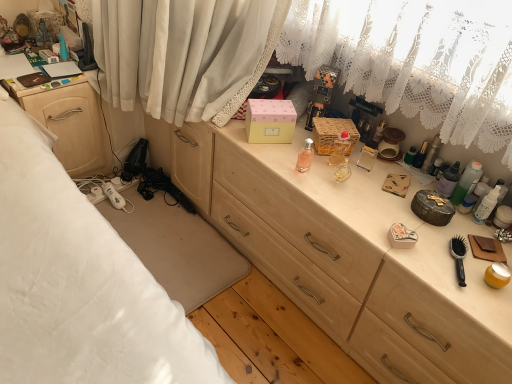
The height and width of the screenshot is (384, 512). What are the coordinates of `white glossy lotion at right, which ranks as the first toiletry in right-to-left order` in the screenshot? It's located at (486, 205).

Describe the element at coordinates (270, 121) in the screenshot. The image size is (512, 384). I see `pink matte box at center` at that location.

Measure the distance between point (332, 160) and camera.

The depth of point (332, 160) is 1.57 meters.

Measure the distance between light wood desk at center and camera.

The depth of light wood desk at center is 1.02 meters.

Find the location of `white glossy lotion at right, which is the fifth toiletry in left-to-right order`. white glossy lotion at right, which is the fifth toiletry in left-to-right order is located at coordinates (486, 205).

Considering the sizes of objects translucent plastic bottles at right, which ranks as the third toiletry in left-to-right order, and translucent glass perfume at center, acting as the second toiletry starting from the left, in the image provided, who is smaller, translucent plastic bottles at right, which ranks as the third toiletry in left-to-right order, or translucent glass perfume at center, acting as the second toiletry starting from the left,?

With smaller size is translucent plastic bottles at right, which ranks as the third toiletry in left-to-right order.

Would you say translucent glass perfume at center, acting as the second toiletry starting from the left, is part of translucent plastic bottles at right, the 3th toiletry in the right-to-left sequence,'s contents?

No, translucent glass perfume at center, acting as the second toiletry starting from the left, is not surrounded by translucent plastic bottles at right, the 3th toiletry in the right-to-left sequence.

Looking at this image, is translucent plastic bottles at right, the 3th toiletry in the right-to-left sequence, looking in the opposite direction of translucent glass perfume at center, acting as the 4th toiletry starting from the right?

No, translucent plastic bottles at right, the 3th toiletry in the right-to-left sequence, is not facing the opposite direction of translucent glass perfume at center, acting as the 4th toiletry starting from the right.

From a real-world perspective, between translucent plastic bottles at right, the 3th toiletry in the right-to-left sequence, and translucent glass perfume at center, acting as the 4th toiletry starting from the right, who is vertically lower?

translucent glass perfume at center, acting as the 4th toiletry starting from the right, from a real-world perspective.

Considering the points (390, 351) and (337, 121), which point is in front, point (390, 351) or point (337, 121)?

The point (390, 351) is closer to the camera.

Between light wood desk at center and woven brown picnic basket at center, which one has more height?

With more height is light wood desk at center.

Is light wood desk at center looking in the opposite direction of woven brown picnic basket at center?

No, light wood desk at center is not facing the opposite direction of woven brown picnic basket at center.

Is woven brown picnic basket at center located within light wood desk at center?

Definitely not — woven brown picnic basket at center is not inside light wood desk at center.

How many degrees apart are the facing directions of matte wood nightstand at left and woven brown picnic basket at center?

They differ by 34.4 degrees in their facing directions.

Is matte wood nightstand at left aimed at woven brown picnic basket at center?

No, matte wood nightstand at left is not oriented towards woven brown picnic basket at center.

Can you confirm if matte wood nightstand at left is wider than woven brown picnic basket at center?

Yes.

Is point (6, 89) positioned after point (328, 151)?

Yes, point (6, 89) is farther from viewer.

Based on the photo, from the image's perspective, which one is positioned lower, pink matte box at center or light wood desk at center?

light wood desk at center appears lower in the image.

Looking at this image, which is more to the right, pink matte box at center or light wood desk at center?

light wood desk at center.

From a real-world perspective, between pink matte box at center and light wood desk at center, who is vertically lower?

From a 3D spatial view, light wood desk at center is below.

Between translucent glass perfume at center, acting as the 4th toiletry starting from the right, and matte wood nightstand at left, which one has smaller size?

translucent glass perfume at center, acting as the 4th toiletry starting from the right.

Between translucent glass perfume at center, acting as the second toiletry starting from the left, and matte wood nightstand at left, which one is positioned in front?

translucent glass perfume at center, acting as the second toiletry starting from the left, is more forward.

Does point (349, 136) come farther from viewer compared to point (85, 146)?

No, it is not.

From the image's perspective, between translucent glass perfume at center, acting as the 4th toiletry starting from the right, and matte wood nightstand at left, which one is located above?

From the image's view, matte wood nightstand at left is above.

Is point (487, 210) closer or farther from the camera than point (223, 152)?

Clearly, point (487, 210) is closer to the camera than point (223, 152).

Which of these two, white glossy lotion at right, which is the fifth toiletry in left-to-right order, or light wood desk at center, is smaller?

With smaller size is white glossy lotion at right, which is the fifth toiletry in left-to-right order.

Does white glossy lotion at right, which is the fifth toiletry in left-to-right order, come in front of light wood desk at center?

That is False.

Can you tell me how much white glossy lotion at right, which is the fifth toiletry in left-to-right order, and light wood desk at center differ in facing direction?

white glossy lotion at right, which is the fifth toiletry in left-to-right order, and light wood desk at center are facing 1.85 degrees away from each other.

Does translucent glass perfume at center, acting as the second toiletry starting from the left, appear on the left side of translucent plastic bottles at right, positioned as the 4th toiletry in left-to-right order?

Yes.

At what (x,y) coordinates should I click in order to perform the action: click on the 3rd toiletry in front of the translucent glass perfume at center, acting as the second toiletry starting from the left. Please return your answer as a coordinate pair (x, y). This screenshot has width=512, height=384. Looking at the image, I should click on (466, 182).

Who is smaller, translucent glass perfume at center, acting as the second toiletry starting from the left, or translucent plastic bottles at right, positioned as the 4th toiletry in left-to-right order?

translucent glass perfume at center, acting as the second toiletry starting from the left, is smaller.

Does translucent glass perfume at center, acting as the 4th toiletry starting from the right, have a greater height compared to translucent plastic bottles at right, the second toiletry when ordered from right to left?

No.

Which toiletry is the 1st one when counting from the left side of the translucent plastic bottles at right, which ranks as the third toiletry in left-to-right order? Please provide its 2D coordinates.

[(339, 149)]

The height and width of the screenshot is (384, 512). Find the location of `picnic basket behind the light wood desk at center`. picnic basket behind the light wood desk at center is located at coordinates (332, 134).

When comparing their distances from white glossy lotion at right, which ranks as the first toiletry in right-to-left order, does woven brown picnic basket at center or light wood desk at center seem closer?

woven brown picnic basket at center lies closer to white glossy lotion at right, which ranks as the first toiletry in right-to-left order, than the other object.

Considering their positions, is woven brown picnic basket at center positioned further to matte wood nightstand at left than translucent plastic bottles at right, positioned as the 4th toiletry in left-to-right order?

translucent plastic bottles at right, positioned as the 4th toiletry in left-to-right order.

Considering their positions, is light wood desk at center positioned closer to translucent plastic bottles at right, the second toiletry when ordered from right to left, than matte wood nightstand at left?

The object closer to translucent plastic bottles at right, the second toiletry when ordered from right to left, is light wood desk at center.

Considering their positions, is translucent glass perfume at center, acting as the second toiletry starting from the left, positioned further to pink glass perfume at center, the first toiletry in the left-to-right sequence, than pink matte box at center?

pink matte box at center is further to pink glass perfume at center, the first toiletry in the left-to-right sequence.

From the image, which object appears to be nearer to white glossy lotion at right, which is the fifth toiletry in left-to-right order, translucent plastic bottles at right, positioned as the 4th toiletry in left-to-right order, or woven brown picnic basket at center?

Among the two, translucent plastic bottles at right, positioned as the 4th toiletry in left-to-right order, is located nearer to white glossy lotion at right, which is the fifth toiletry in left-to-right order.

From the image, which object appears to be nearer to woven brown picnic basket at center, white glossy lotion at right, which ranks as the first toiletry in right-to-left order, or pink matte box at center?

pink matte box at center lies closer to woven brown picnic basket at center than the other object.

When comparing their distances from white glossy lotion at right, which ranks as the first toiletry in right-to-left order, does pink matte box at center or translucent plastic bottles at right, positioned as the 4th toiletry in left-to-right order, seem closer?

translucent plastic bottles at right, positioned as the 4th toiletry in left-to-right order, is positioned closer to the anchor white glossy lotion at right, which ranks as the first toiletry in right-to-left order.

Looking at the image, which one is located closer to translucent plastic bottles at right, which ranks as the third toiletry in left-to-right order, pink glass perfume at center, marked as the 5th toiletry in a right-to-left arrangement, or white glossy lotion at right, which is the fifth toiletry in left-to-right order?

white glossy lotion at right, which is the fifth toiletry in left-to-right order, is positioned closer to the anchor translucent plastic bottles at right, which ranks as the third toiletry in left-to-right order.

Where is `picnic basket situated between matte wood nightstand at left and translucent plastic bottles at right, positioned as the 4th toiletry in left-to-right order, from left to right`? This screenshot has width=512, height=384. picnic basket situated between matte wood nightstand at left and translucent plastic bottles at right, positioned as the 4th toiletry in left-to-right order, from left to right is located at coordinates (332, 134).

The height and width of the screenshot is (384, 512). I want to click on picnic basket between pink matte box at center and white glossy lotion at right, which ranks as the first toiletry in right-to-left order, so click(332, 134).

At what (x,y) coordinates should I click in order to perform the action: click on picnic basket positioned between light wood desk at center and pink matte box at center from near to far. Please return your answer as a coordinate pair (x, y). The image size is (512, 384). Looking at the image, I should click on (332, 134).

You are a GUI agent. You are given a task and a screenshot of the screen. Output one action in this format:
    pyautogui.click(x=<x>, y=<y>)
    Task: Click on the toiletry situated between pink matte box at center and translucent glass perfume at center, acting as the 4th toiletry starting from the right, from left to right
    The image size is (512, 384).
    Given the screenshot: What is the action you would take?
    pyautogui.click(x=305, y=157)